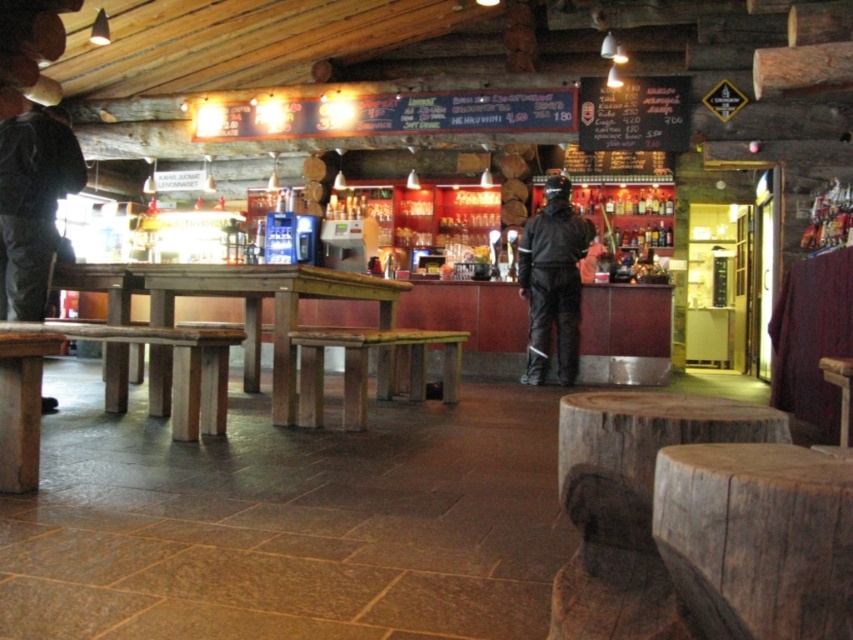
Question: Estimate the real-world distances between objects in this image. Which object is farther from the black matte jacket at center?

Choices:
 (A) wooden bar stool at center
 (B) wooden table at center

Answer: (B)

Question: In this image, where is black matte jacket at center located relative to wooden bar stool at center?

Choices:
 (A) right
 (B) left

Answer: (A)

Question: Which point is closer to the camera taking this photo?

Choices:
 (A) (537, 253)
 (B) (384, 372)

Answer: (B)

Question: Does black matte jacket at center have a smaller size compared to wooden bar stool at center?

Choices:
 (A) no
 (B) yes

Answer: (B)

Question: Which point appears farthest from the camera in this image?

Choices:
 (A) (576, 296)
 (B) (347, 284)
 (C) (299, 349)

Answer: (A)

Question: Can you confirm if wooden table at center is smaller than wooden bar stool at center?

Choices:
 (A) no
 (B) yes

Answer: (A)